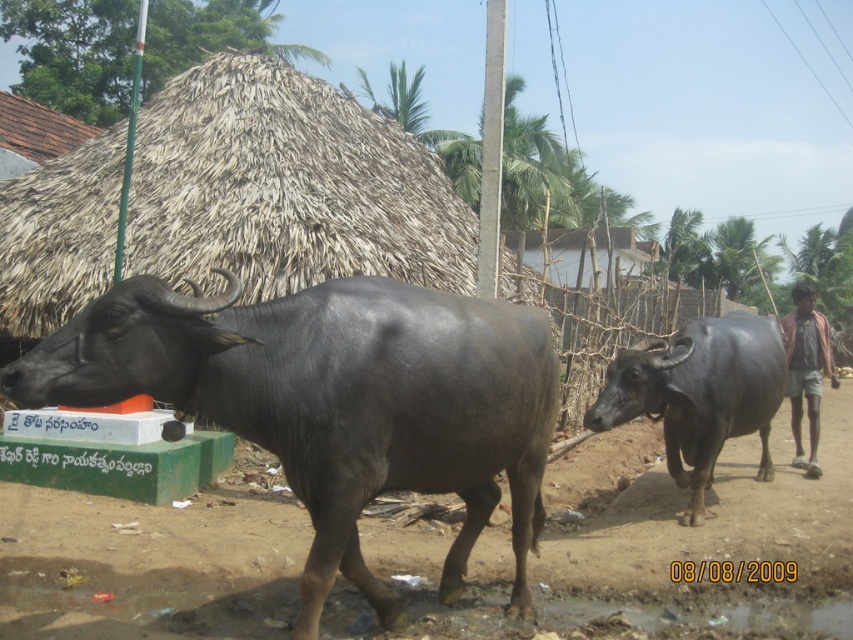
Which of these two, black glossy bull at left or brown cotton shirt at right, stands taller?

brown cotton shirt at right

Can you confirm if black glossy bull at left is positioned below brown cotton shirt at right?

Yes, black glossy bull at left is below brown cotton shirt at right.

The height and width of the screenshot is (640, 853). Identify the location of black glossy bull at left. (334, 401).

Between black glossy bull at left and shiny black bull at center, which one is positioned lower?

shiny black bull at center

Can you confirm if black glossy bull at left is positioned below shiny black bull at center?

No, black glossy bull at left is not below shiny black bull at center.

Who is more distant from viewer, (421, 440) or (741, 378)?

The point (741, 378) is more distant.

Locate an element on the screen. Image resolution: width=853 pixels, height=640 pixels. black glossy bull at left is located at coordinates (334, 401).

Which is above, shiny black bull at center or brown cotton shirt at right?

brown cotton shirt at right

Does point (712, 326) come farther from viewer compared to point (804, 380)?

That is False.

Image resolution: width=853 pixels, height=640 pixels. In order to click on shiny black bull at center in this screenshot , I will do [x=699, y=394].